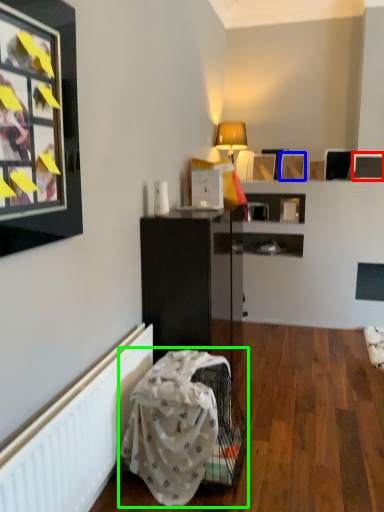
Question: Which object is the farthest from picture frame (highlighted by a red box)? Choose among these: picture frame (highlighted by a blue box) or swivel chair (highlighted by a green box).

Choices:
 (A) picture frame
 (B) swivel chair

Answer: (B)